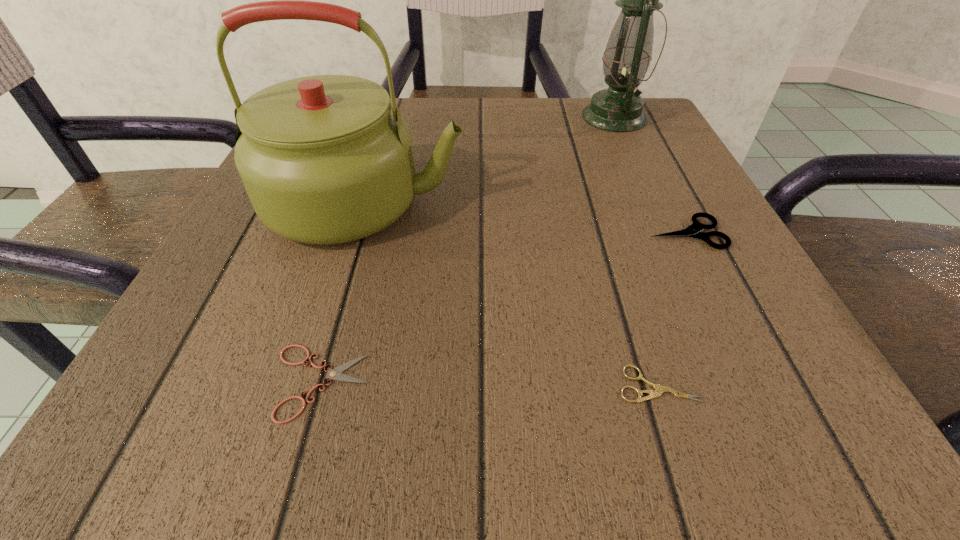
Image resolution: width=960 pixels, height=540 pixels. In the image, there is a desktop. In order to click on vacant space at the right edge in this screenshot , I will do `click(661, 244)`.

This screenshot has height=540, width=960. What are the coordinates of `vacant space at the far right corner of the desktop` in the screenshot? It's located at (660, 118).

Locate an element on the screen. The height and width of the screenshot is (540, 960). vacant space at the near right corner of the desktop is located at coordinates (685, 379).

Find the location of a particular element. unoccupied area between the second shears from right to left and the leftmost shears is located at coordinates (490, 383).

The width and height of the screenshot is (960, 540). Identify the location of free space between the leftmost shears and the kettle. (343, 293).

At what (x,y) coordinates should I click in order to perform the action: click on vacant space that is in between the oil lamp and the second shears from right to left. Please return your answer as a coordinate pair (x, y). This screenshot has height=540, width=960. Looking at the image, I should click on (636, 251).

Locate an element on the screen. Image resolution: width=960 pixels, height=540 pixels. free spot between the leftmost shears and the kettle is located at coordinates (343, 293).

Where is `vacant point located between the leftmost shears and the kettle`? vacant point located between the leftmost shears and the kettle is located at coordinates (343, 293).

At what (x,y) coordinates should I click in order to perform the action: click on vacant area between the kettle and the farthest object. Please return your answer as a coordinate pair (x, y). Looking at the image, I should click on (490, 160).

Identify the location of unoccupied area between the second shears from left to right and the kettle. (512, 294).